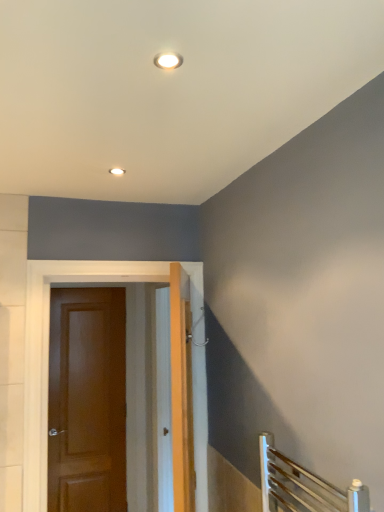
Question: Is matte white recessed light at upper center oriented away from matte brown door at left, which appears as the first door when viewed from the left?

Choices:
 (A) no
 (B) yes

Answer: (A)

Question: Is matte white recessed light at upper center oriented towards matte brown door at left, positioned as the first door in back-to-front order?

Choices:
 (A) yes
 (B) no

Answer: (B)

Question: Is matte white recessed light at upper center taller than matte brown door at left, which appears as the first door when viewed from the left?

Choices:
 (A) no
 (B) yes

Answer: (A)

Question: Is matte white recessed light at upper center to the left of matte brown door at left, positioned as the second door in right-to-left order, from the viewer's perspective?

Choices:
 (A) yes
 (B) no

Answer: (B)

Question: Is matte white recessed light at upper center outside of matte brown door at left, the second door viewed from the front?

Choices:
 (A) yes
 (B) no

Answer: (A)

Question: From a real-world perspective, is matte white recessed light at upper center above or below matte brown door at left, the second door viewed from the front?

Choices:
 (A) above
 (B) below

Answer: (A)

Question: Based on their sizes in the image, would you say matte white recessed light at upper center is bigger or smaller than matte brown door at left, positioned as the second door in right-to-left order?

Choices:
 (A) big
 (B) small

Answer: (B)

Question: Considering the positions of matte white recessed light at upper center and matte brown door at left, which appears as the first door when viewed from the left, in the image, is matte white recessed light at upper center taller or shorter than matte brown door at left, which appears as the first door when viewed from the left,?

Choices:
 (A) short
 (B) tall

Answer: (A)

Question: Visually, is matte white recessed light at upper center positioned to the left or to the right of matte brown door at left, positioned as the second door in right-to-left order?

Choices:
 (A) left
 (B) right

Answer: (B)

Question: Is brown wooden door at center, which appears as the first door when viewed from the front, in front of or behind matte white recessed light at upper center in the image?

Choices:
 (A) behind
 (B) front

Answer: (A)

Question: In terms of width, does brown wooden door at center, which appears as the first door when viewed from the front, look wider or thinner when compared to matte white recessed light at upper center?

Choices:
 (A) wide
 (B) thin

Answer: (A)

Question: Considering the positions of brown wooden door at center, the 2th door viewed from the back, and matte white recessed light at upper center in the image, is brown wooden door at center, the 2th door viewed from the back, taller or shorter than matte white recessed light at upper center?

Choices:
 (A) short
 (B) tall

Answer: (B)

Question: Which is correct: brown wooden door at center, arranged as the second door when viewed from the left, is inside matte white recessed light at upper center, or outside of it?

Choices:
 (A) inside
 (B) outside

Answer: (B)

Question: Considering their positions, is matte brown door at left, positioned as the first door in back-to-front order, located in front of or behind matte white recessed light at upper center?

Choices:
 (A) behind
 (B) front

Answer: (A)

Question: In the image, is matte brown door at left, the second door viewed from the front, on the left side or the right side of matte white recessed light at upper center?

Choices:
 (A) right
 (B) left

Answer: (B)